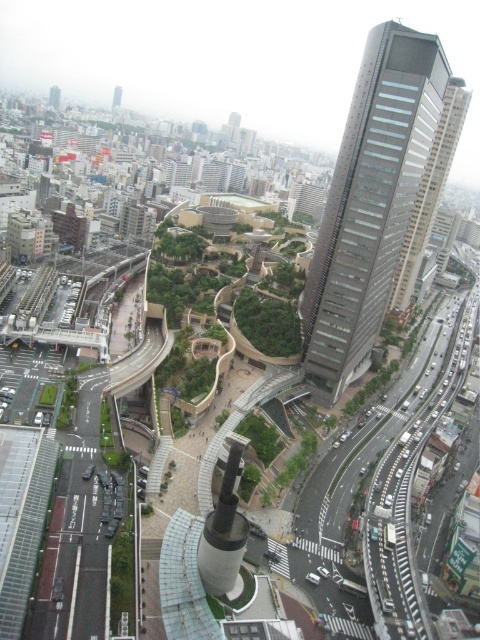
Is matte glass skyscraper at upper right smaller than gray concrete skyscraper at upper center?

No, matte glass skyscraper at upper right is not smaller than gray concrete skyscraper at upper center.

Is matte glass skyscraper at upper right to the right of gray concrete skyscraper at upper center from the viewer's perspective?

In fact, matte glass skyscraper at upper right is to the left of gray concrete skyscraper at upper center.

The width and height of the screenshot is (480, 640). What do you see at coordinates (54, 97) in the screenshot?
I see `matte glass skyscraper at upper right` at bounding box center [54, 97].

I want to click on matte glass skyscraper at upper right, so click(54, 97).

Locate an element on the screen. Image resolution: width=480 pixels, height=640 pixels. gray glass skyscraper at right is located at coordinates point(371,200).

What do you see at coordinates (371, 200) in the screenshot? I see `gray glass skyscraper at right` at bounding box center [371, 200].

Find the location of a particular element. The width and height of the screenshot is (480, 640). gray glass skyscraper at right is located at coordinates (371, 200).

Which is in front, point (360, 68) or point (115, 99)?

Point (360, 68)

Is gray glass skyscraper at right bigger than gray concrete skyscraper at upper center?

Yes.

I want to click on gray glass skyscraper at right, so click(x=371, y=200).